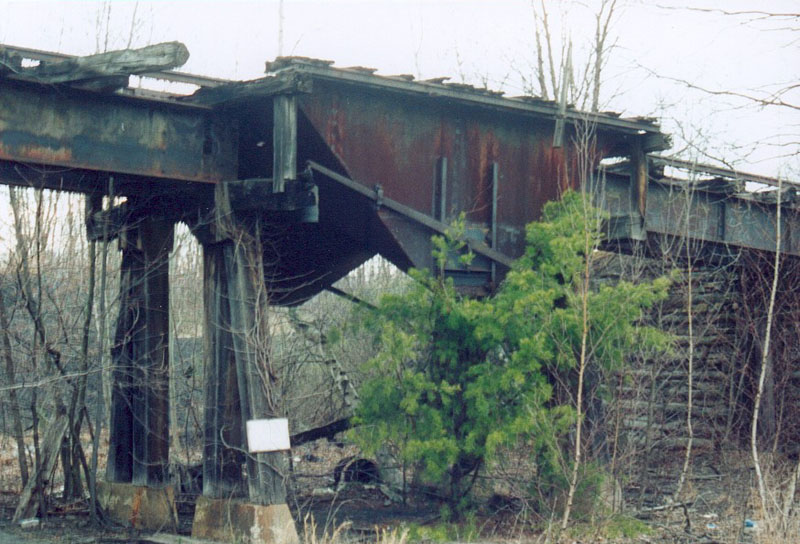
At what (x,y) coordinates should I click in order to perform the action: click on support beams. Please return your answer as a coordinate pair (x, y). The image size is (800, 544). Looking at the image, I should click on (246, 362), (146, 315), (80, 147).